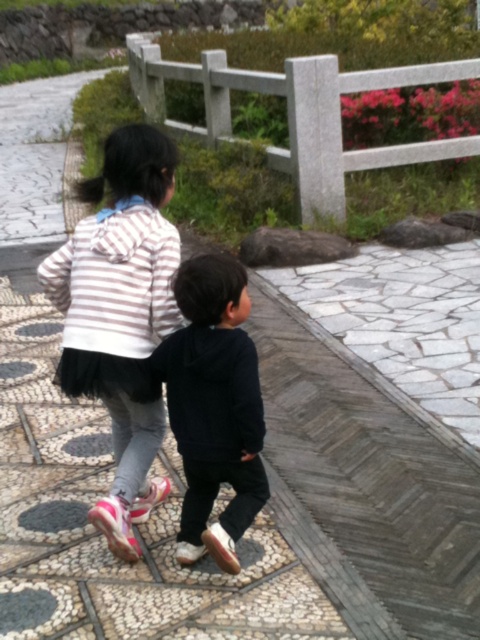
Question: Among these objects, which one is nearest to the camera?

Choices:
 (A) dark blue hoodie at center
 (B) striped hoodie at center

Answer: (A)

Question: Among these points, which one is nearest to the camera?

Choices:
 (A) (119, 192)
 (B) (227, 460)

Answer: (B)

Question: Can you confirm if striped hoodie at center is positioned to the right of dark blue hoodie at center?

Choices:
 (A) no
 (B) yes

Answer: (A)

Question: Is striped hoodie at center further to the viewer compared to dark blue hoodie at center?

Choices:
 (A) no
 (B) yes

Answer: (B)

Question: Does striped hoodie at center have a smaller size compared to dark blue hoodie at center?

Choices:
 (A) no
 (B) yes

Answer: (A)